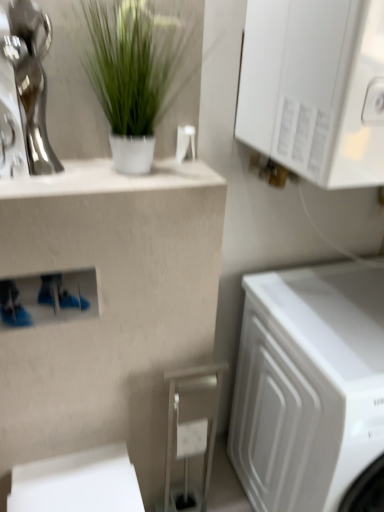
The image size is (384, 512). Find the location of `empty space that is to the right of shiny silver statue at upper left`. empty space that is to the right of shiny silver statue at upper left is located at coordinates (x=85, y=175).